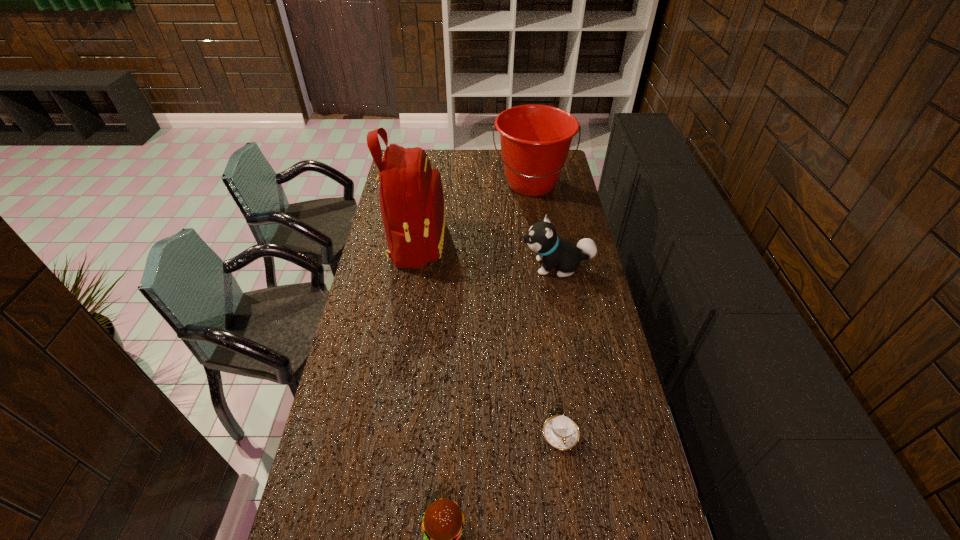
Find the location of a particular element. free space between the backpack and the farthest object is located at coordinates (474, 213).

At what (x,y) coordinates should I click in order to perform the action: click on empty space that is in between the teacup and the fourth shortest object. Please return your answer as a coordinate pair (x, y). Looking at the image, I should click on tap(546, 309).

Identify the location of empty space between the teacup and the tallest object. (489, 339).

This screenshot has width=960, height=540. I want to click on unoccupied position between the teacup and the puppy, so click(559, 350).

Select which object appears as the closest to the second object from left to right. Please provide its 2D coordinates. Your answer should be formatted as a tuple, i.e. [(x, y)], where the tuple contains the x and y coordinates of a point satisfying the conditions above.

[(561, 432)]

Select which object appears as the fourth closest to the bucket. Please provide its 2D coordinates. Your answer should be formatted as a tuple, i.e. [(x, y)], where the tuple contains the x and y coordinates of a point satisfying the conditions above.

[(443, 522)]